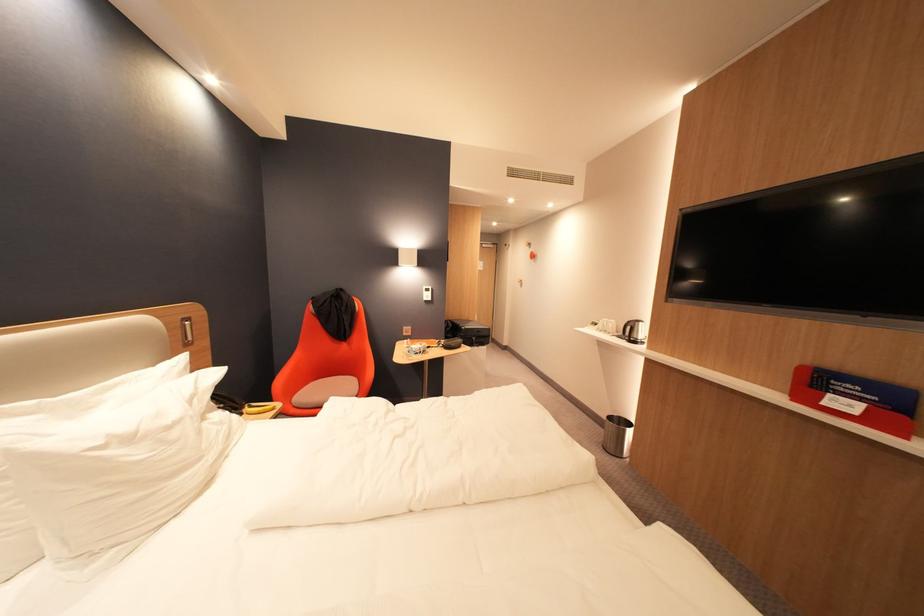
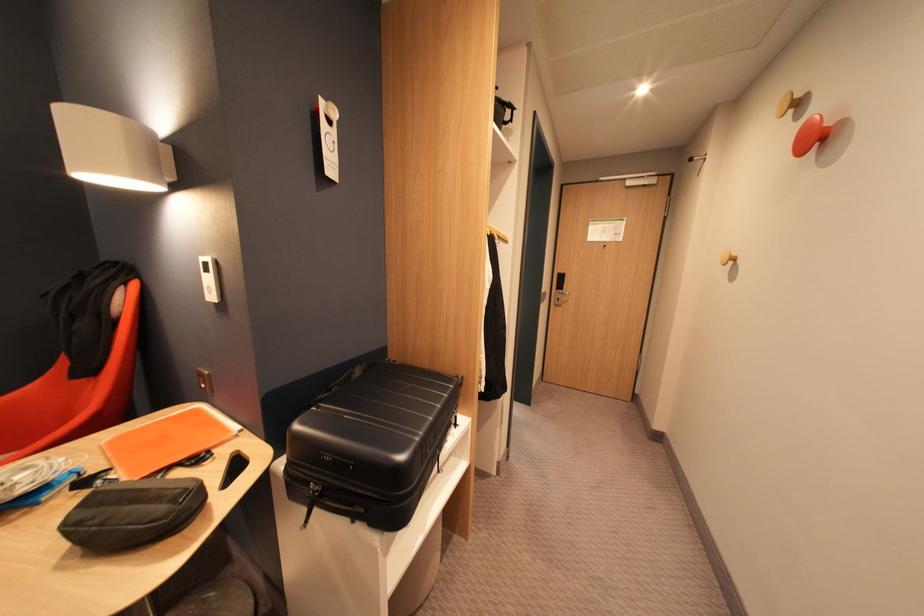
In the second image, find the point that corresponds to point (540, 249) in the first image.

(809, 118)